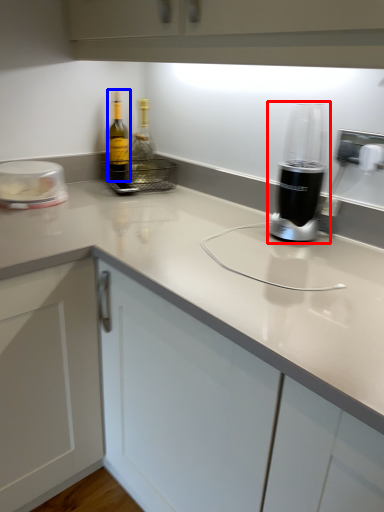
Question: Which point is further to the camera, home appliance (highlighted by a red box) or bottle (highlighted by a blue box)?

Choices:
 (A) home appliance
 (B) bottle

Answer: (B)